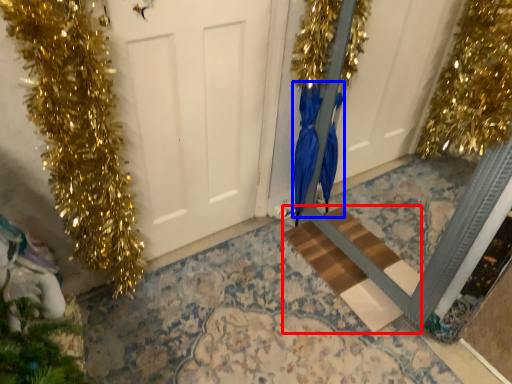
Question: Which point is further to the camera, stairwell (highlighted by a red box) or dress (highlighted by a blue box)?

Choices:
 (A) stairwell
 (B) dress

Answer: (A)